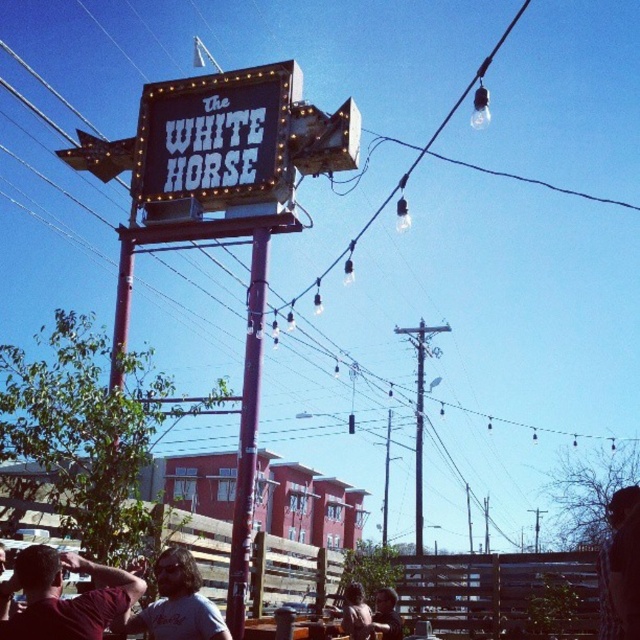
Can you confirm if black illuminated sign at upper center is wider than dark brown leather jacket at lower center?

Yes.

Describe the element at coordinates (216, 138) in the screenshot. I see `black illuminated sign at upper center` at that location.

Where is `black illuminated sign at upper center`? black illuminated sign at upper center is located at coordinates (216, 138).

Between maroon shirt at lower left and brown leather jacket at lower center, which one appears on the right side from the viewer's perspective?

brown leather jacket at lower center

Is point (33, 612) farther from camera compared to point (356, 612)?

No, it is in front of (356, 612).

Is point (26, 605) less distant than point (358, 625)?

Yes, point (26, 605) is in front of point (358, 625).

Find the location of a particular element. The image size is (640, 640). maroon shirt at lower left is located at coordinates (65, 600).

Identify the location of maroon shirt at lower left. The height and width of the screenshot is (640, 640). (65, 600).